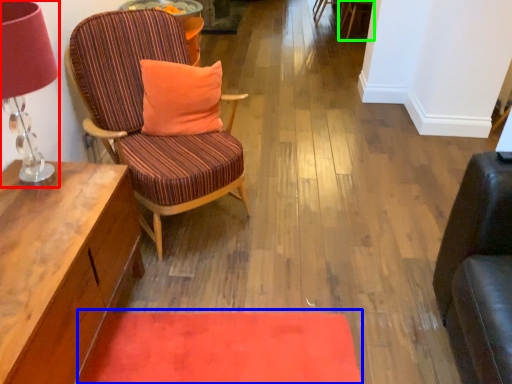
Question: Which object is the closest to the table lamp (highlighted by a red box)? Choose among these: mat (highlighted by a blue box) or chair (highlighted by a green box).

Choices:
 (A) mat
 (B) chair

Answer: (A)